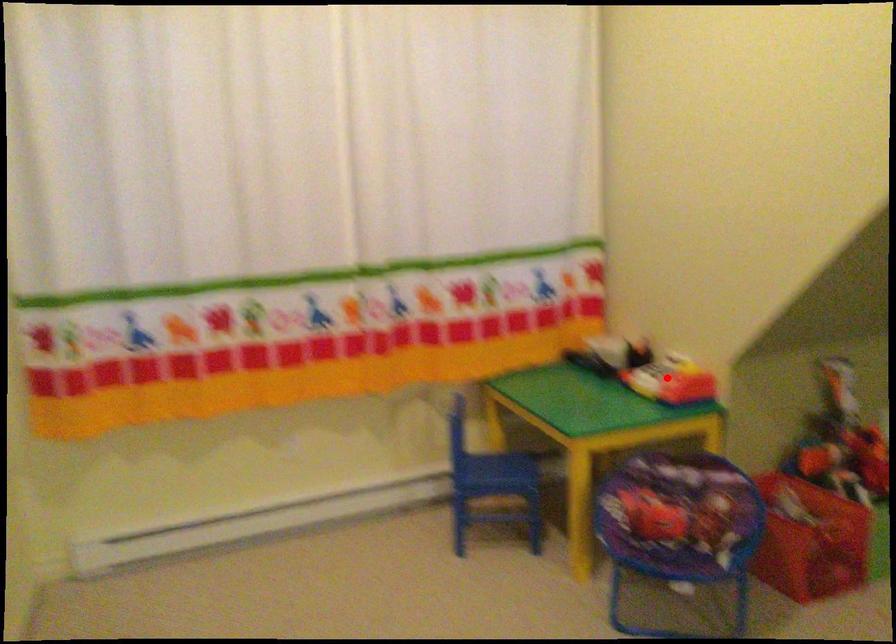
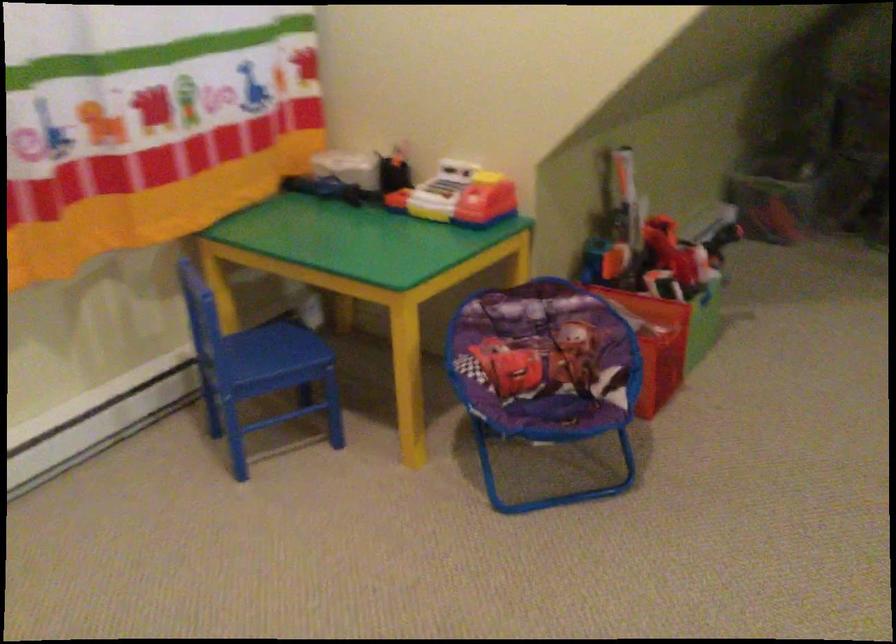
Locate, in the second image, the point that corresponds to the highlighted location in the first image.

(458, 196)